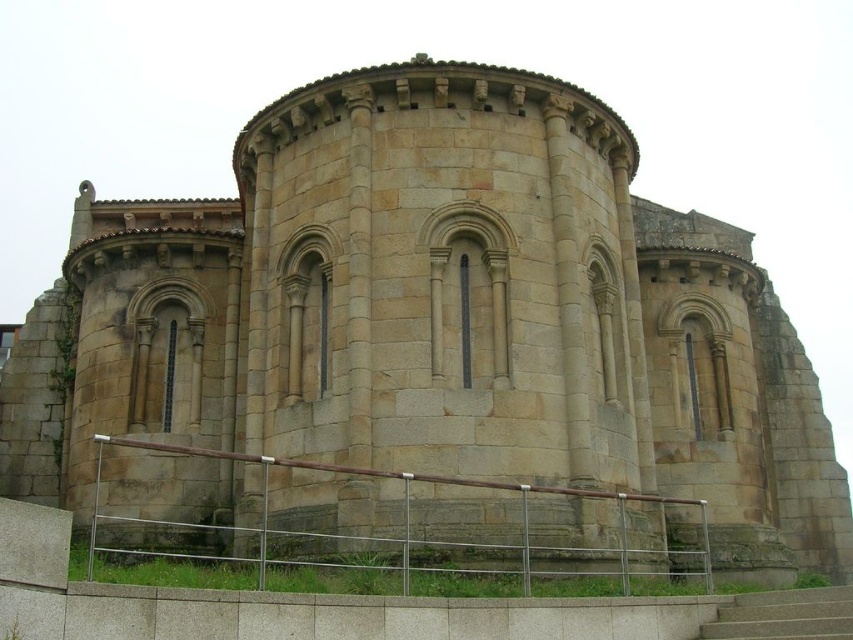
Question: Which of the following is the farthest from the observer?

Choices:
 (A) (326, 547)
 (B) (773, 600)

Answer: (A)

Question: Can you confirm if silver metallic railing at lower center is positioned to the left of smooth concrete stairs at lower center?

Choices:
 (A) yes
 (B) no

Answer: (A)

Question: From the image, what is the correct spatial relationship of silver metallic railing at lower center in relation to smooth concrete stairs at lower center?

Choices:
 (A) left
 (B) right

Answer: (A)

Question: Among these objects, which one is nearest to the camera?

Choices:
 (A) silver metallic railing at lower center
 (B) smooth concrete stairs at lower center

Answer: (A)

Question: Can you confirm if silver metallic railing at lower center is positioned to the right of smooth concrete stairs at lower center?

Choices:
 (A) no
 (B) yes

Answer: (A)